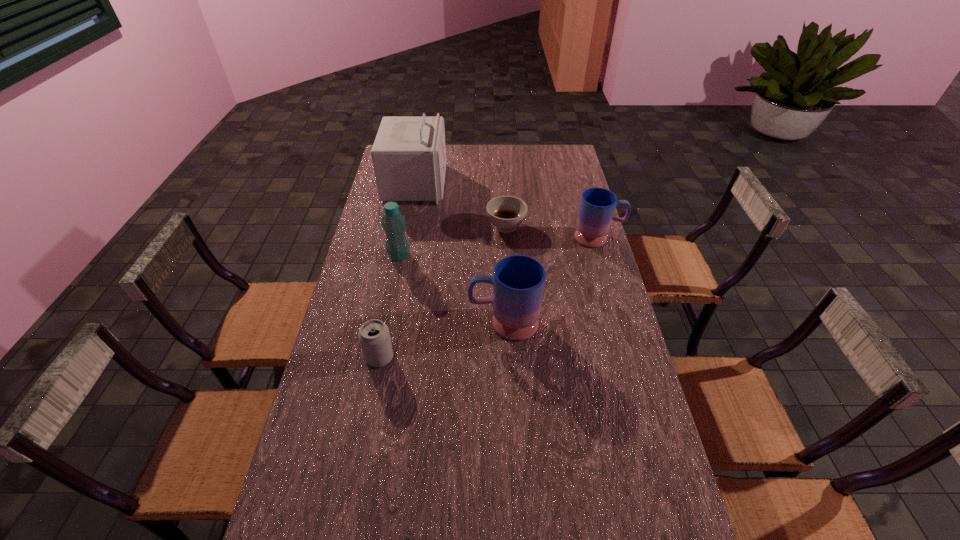
Locate an element on the screen. The height and width of the screenshot is (540, 960). the nearer mug is located at coordinates (518, 281).

The height and width of the screenshot is (540, 960). Find the location of `the left mug`. the left mug is located at coordinates (518, 281).

I want to click on the shorter mug, so click(597, 205).

Locate an element on the screen. This screenshot has height=540, width=960. the farther mug is located at coordinates pos(597,205).

You are a GUI agent. You are given a task and a screenshot of the screen. Output one action in this format:
    pyautogui.click(x=<x>, y=<y>)
    Task: Click on the soup bowl
    The width and height of the screenshot is (960, 540).
    Given the screenshot: What is the action you would take?
    pyautogui.click(x=506, y=212)

I want to click on the farthest object, so click(x=409, y=152).

At what (x,y) coordinates should I click in order to perform the action: click on the first-aid kit. Please return your answer as a coordinate pair (x, y). The image size is (960, 540). Looking at the image, I should click on (409, 152).

Locate an element on the screen. The width and height of the screenshot is (960, 540). water bottle is located at coordinates (394, 224).

Locate an element on the screen. The height and width of the screenshot is (540, 960). can is located at coordinates (374, 336).

You are a GUI agent. You are given a task and a screenshot of the screen. Output one action in this format:
    pyautogui.click(x=<x>, y=<y>)
    Task: Click on the nearest object
    
    Given the screenshot: What is the action you would take?
    pyautogui.click(x=374, y=336)